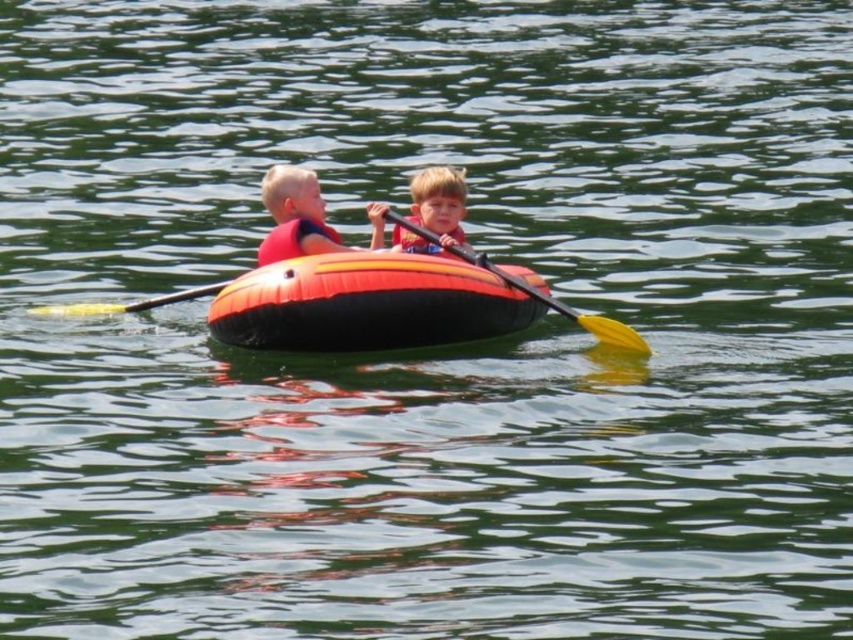
Question: Can you confirm if matte red life vest at center is positioned to the left of smooth orange life preserver at center?

Choices:
 (A) yes
 (B) no

Answer: (A)

Question: Which is farther from the orange matte inflatable boat at center?

Choices:
 (A) red matte life jacket at center
 (B) yellow foam paddle at center

Answer: (B)

Question: Can you confirm if yellow plastic paddle at center is positioned to the right of red matte life jacket at center?

Choices:
 (A) yes
 (B) no

Answer: (A)

Question: Among these points, which one is nearest to the camera?

Choices:
 (A) (x=416, y=209)
 (B) (x=325, y=234)

Answer: (B)

Question: Is orange matte inflatable boat at center thinner than yellow foam paddle at center?

Choices:
 (A) no
 (B) yes

Answer: (A)

Question: Which point is farther from the camera taking this photo?

Choices:
 (A) (264, 202)
 (B) (91, 314)

Answer: (B)